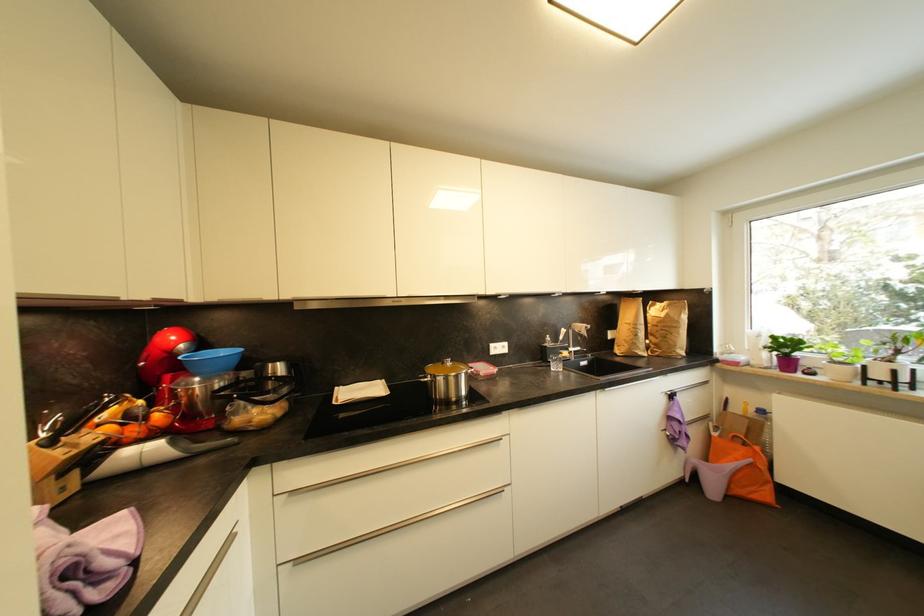
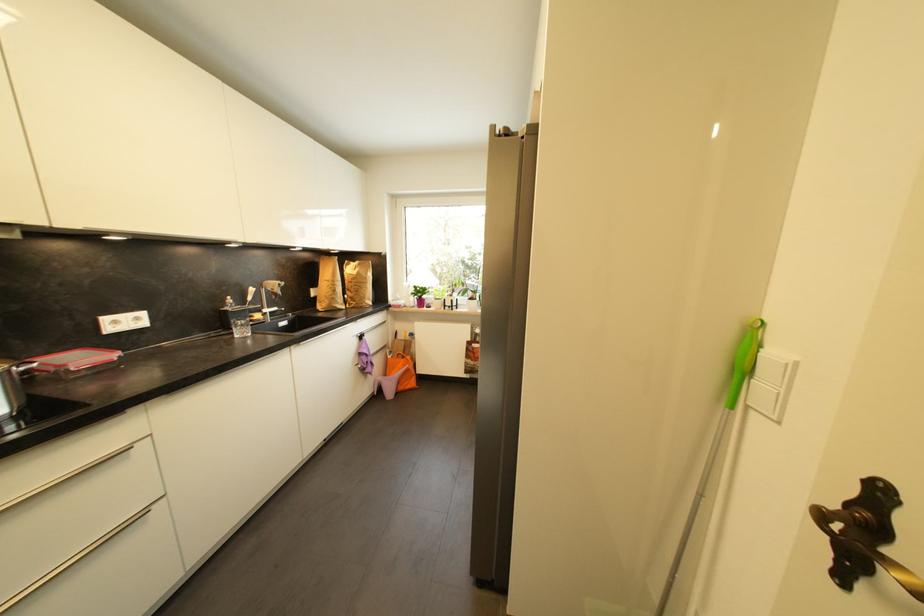
Question: How did the camera likely rotate?

Choices:
 (A) Left
 (B) Right
 (C) Up
 (D) Down

Answer: (B)